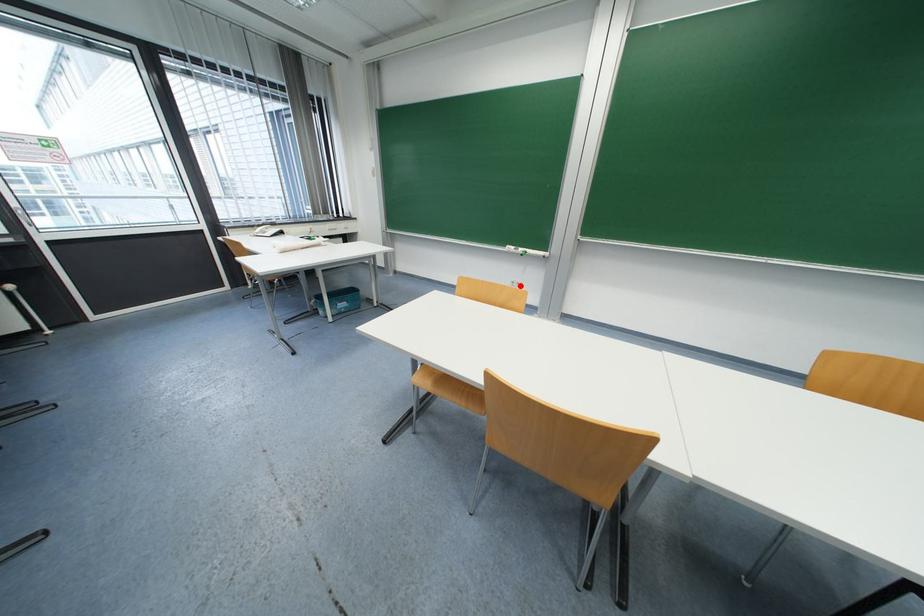
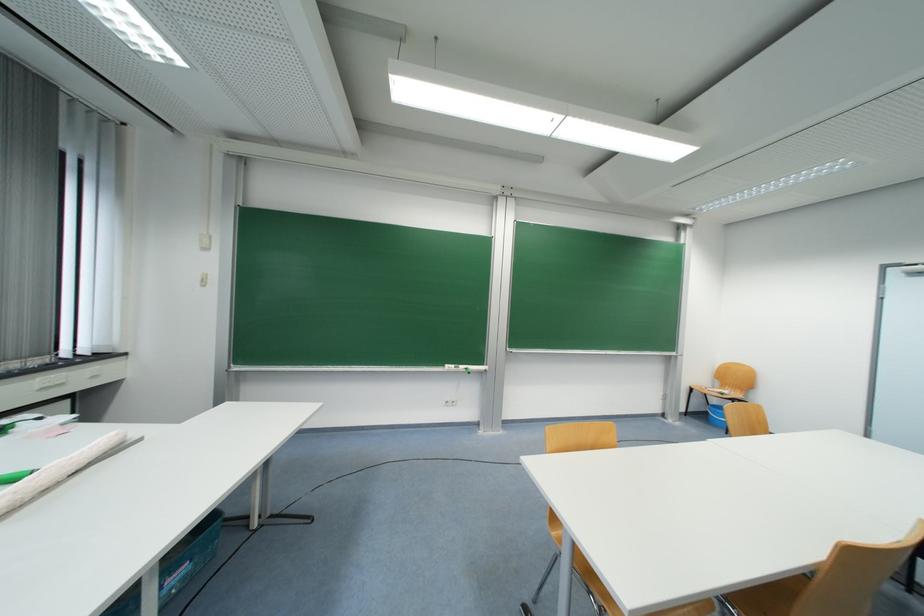
Question: A red point is marked in image1. In image2, is the corresponding 3D point closer to the camera or farther? Reply with the corresponding letter.

Choices:
 (A) The corresponding 3D point is closer.
 (B) The corresponding 3D point is farther.

Answer: (B)